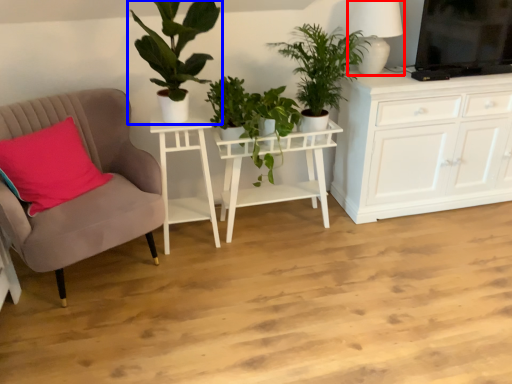
Question: Which object is further to the camera taking this photo, lamp (highlighted by a red box) or houseplant (highlighted by a blue box)?

Choices:
 (A) lamp
 (B) houseplant

Answer: (A)